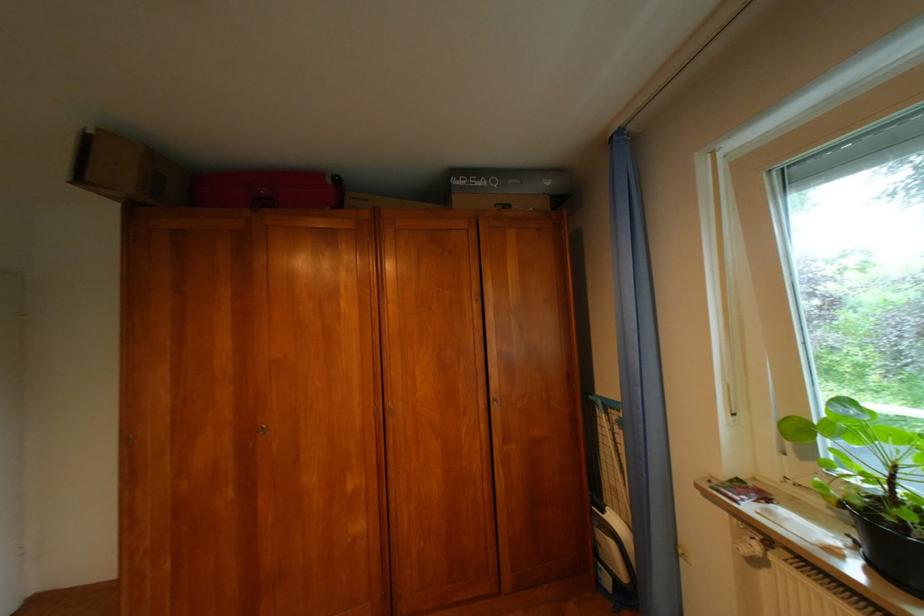
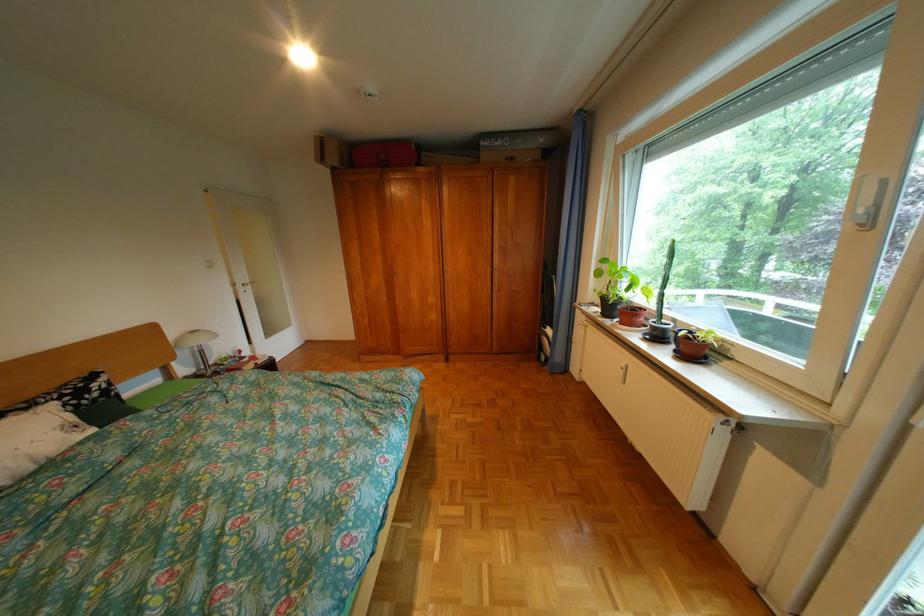
Where in the second image is the point corresponding to the point at 229,446 from the first image?

(392, 280)